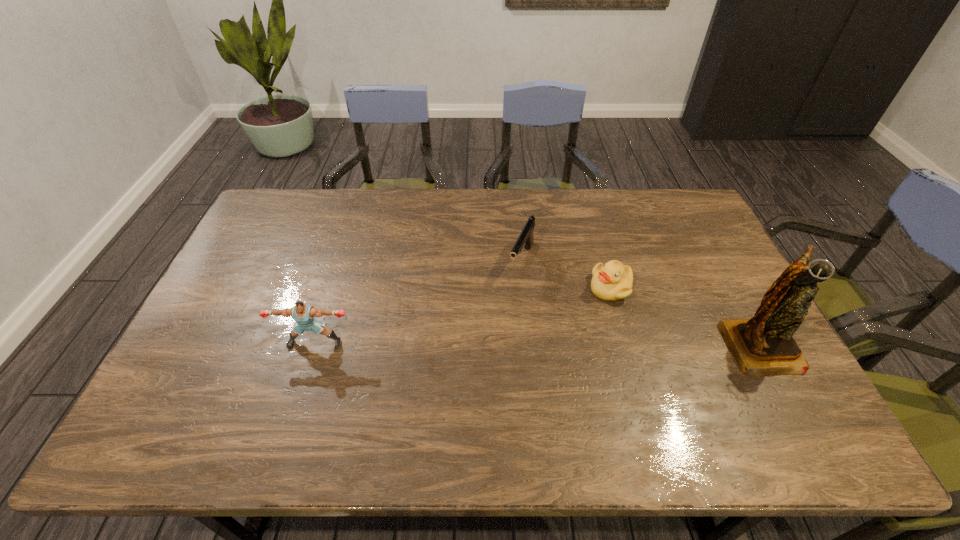
This screenshot has width=960, height=540. What are the coordinates of `puncher` in the screenshot? It's located at (303, 314).

At what (x,y) coordinates should I click in order to perform the action: click on the leftmost object. Please return your answer as a coordinate pair (x, y). Looking at the image, I should click on (303, 314).

You are a GUI agent. You are given a task and a screenshot of the screen. Output one action in this format:
    pyautogui.click(x=<x>, y=<y>)
    Task: Click on the tallest object
    The width and height of the screenshot is (960, 540).
    Given the screenshot: What is the action you would take?
    pyautogui.click(x=762, y=346)

The height and width of the screenshot is (540, 960). In order to click on the rightmost object in this screenshot , I will do `click(762, 346)`.

I want to click on the third object from right to left, so click(526, 238).

This screenshot has height=540, width=960. What are the coordinates of `the third object from left to right` in the screenshot? It's located at (612, 281).

Find the location of a particular element. vacant space positioned on the front-facing side of the second tallest object is located at coordinates (304, 376).

The image size is (960, 540). I want to click on free space located at the muzzle of the pistol, so point(504,308).

You are a GUI agent. You are given a task and a screenshot of the screen. Output one action in this format:
    pyautogui.click(x=<x>, y=<y>)
    Task: Click on the vacant space located at the muzzle of the pistol
    The width and height of the screenshot is (960, 540).
    Given the screenshot: What is the action you would take?
    pyautogui.click(x=491, y=338)

Where is `free space located 0.080m at the muzzle of the pistol`? The height and width of the screenshot is (540, 960). free space located 0.080m at the muzzle of the pistol is located at coordinates (509, 299).